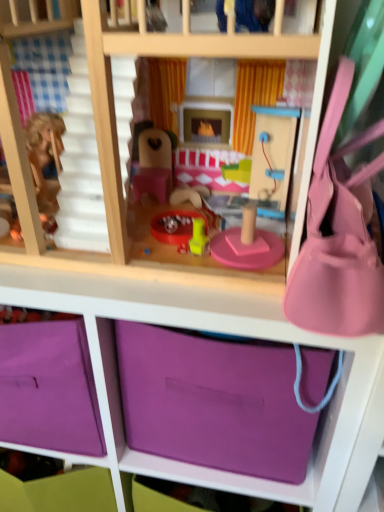
Question: Considering the relative sizes of purple matte storage box at lower center and pink wood bunk bed at center in the image provided, is purple matte storage box at lower center smaller than pink wood bunk bed at center?

Choices:
 (A) yes
 (B) no

Answer: (A)

Question: From the image's perspective, is purple matte storage box at lower center below pink wood bunk bed at center?

Choices:
 (A) yes
 (B) no

Answer: (A)

Question: From the image's perspective, is purple matte storage box at lower center on top of pink wood bunk bed at center?

Choices:
 (A) yes
 (B) no

Answer: (B)

Question: From a real-world perspective, is purple matte storage box at lower center physically below pink wood bunk bed at center?

Choices:
 (A) no
 (B) yes

Answer: (B)

Question: Considering the relative sizes of purple matte storage box at lower center and pink wood bunk bed at center in the image provided, is purple matte storage box at lower center bigger than pink wood bunk bed at center?

Choices:
 (A) no
 (B) yes

Answer: (A)

Question: Considering the positions of pink wood bunk bed at center and pink fabric purse at right in the image, is pink wood bunk bed at center taller or shorter than pink fabric purse at right?

Choices:
 (A) short
 (B) tall

Answer: (B)

Question: From a real-world perspective, is pink wood bunk bed at center positioned above or below pink fabric purse at right?

Choices:
 (A) above
 (B) below

Answer: (A)

Question: Choose the correct answer: Is pink wood bunk bed at center inside pink fabric purse at right or outside it?

Choices:
 (A) outside
 (B) inside

Answer: (A)

Question: Is point (130, 35) closer or farther from the camera than point (367, 301)?

Choices:
 (A) farther
 (B) closer

Answer: (B)

Question: Considering the positions of purple matte storage box at lower center and pink fabric purse at right in the image, is purple matte storage box at lower center taller or shorter than pink fabric purse at right?

Choices:
 (A) short
 (B) tall

Answer: (B)

Question: From the image's perspective, is purple matte storage box at lower center located above or below pink fabric purse at right?

Choices:
 (A) below
 (B) above

Answer: (A)

Question: Is purple matte storage box at lower center to the left or to the right of pink fabric purse at right in the image?

Choices:
 (A) right
 (B) left

Answer: (B)

Question: Looking at the image, does purple matte storage box at lower center seem bigger or smaller compared to pink fabric purse at right?

Choices:
 (A) big
 (B) small

Answer: (A)

Question: Is point (306, 387) closer or farther from the camera than point (9, 118)?

Choices:
 (A) farther
 (B) closer

Answer: (A)

Question: Considering the positions of purple matte storage box at lower center and pink wood bunk bed at center in the image, is purple matte storage box at lower center bigger or smaller than pink wood bunk bed at center?

Choices:
 (A) small
 (B) big

Answer: (A)